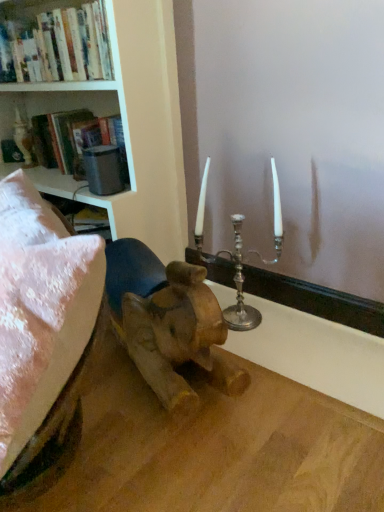
Image resolution: width=384 pixels, height=512 pixels. I want to click on free space to the right of silver metallic candle holder at center, so click(296, 328).